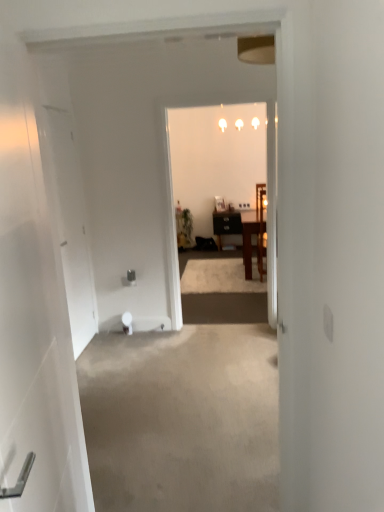
Question: Does wooden chair at center, the 2th chair viewed from the front, have a greater height compared to white glossy light fixture at upper center?

Choices:
 (A) yes
 (B) no

Answer: (A)

Question: Can you confirm if wooden chair at center, the 2th chair viewed from the front, is thinner than white glossy light fixture at upper center?

Choices:
 (A) no
 (B) yes

Answer: (A)

Question: Can you confirm if wooden chair at center, the 2th chair viewed from the front, is shorter than white glossy light fixture at upper center?

Choices:
 (A) no
 (B) yes

Answer: (A)

Question: Is white glossy light fixture at upper center at the back of wooden chair at center, which is the first chair in back-to-front order?

Choices:
 (A) no
 (B) yes

Answer: (A)

Question: Is wooden chair at center, which is the first chair in back-to-front order, positioned in front of white glossy light fixture at upper center?

Choices:
 (A) no
 (B) yes

Answer: (B)

Question: Is white glossy door at left, positioned as the second door in back-to-front order, spatially inside white matte door at left, placed as the first door when sorted from back to front, or outside of it?

Choices:
 (A) inside
 (B) outside

Answer: (B)

Question: From the image's perspective, is white glossy door at left, positioned as the second door in back-to-front order, above or below white matte door at left, the second door in the right-to-left sequence?

Choices:
 (A) above
 (B) below

Answer: (B)

Question: Does point (38, 446) appear closer or farther from the camera than point (72, 321)?

Choices:
 (A) closer
 (B) farther

Answer: (A)

Question: Based on their positions, is white glossy door at left, the 2th door in the left-to-right sequence, located to the left or right of white matte door at left, placed as the first door when sorted from back to front?

Choices:
 (A) left
 (B) right

Answer: (B)

Question: Does point (261, 279) appear closer or farther from the camera than point (61, 114)?

Choices:
 (A) closer
 (B) farther

Answer: (B)

Question: From a real-world perspective, relative to white matte door at left, marked as the 1th door in a left-to-right arrangement, is wooden chair at center, the 2th chair positioned from the back, vertically above or below?

Choices:
 (A) below
 (B) above

Answer: (A)

Question: Is wooden chair at center, the 2th chair positioned from the back, taller or shorter than white matte door at left, placed as the first door when sorted from back to front?

Choices:
 (A) tall
 (B) short

Answer: (B)

Question: Considering the relative positions of wooden chair at center, the 2th chair positioned from the back, and white matte door at left, placed as the first door when sorted from back to front, in the image provided, is wooden chair at center, the 2th chair positioned from the back, to the left or to the right of white matte door at left, placed as the first door when sorted from back to front,?

Choices:
 (A) right
 (B) left

Answer: (A)

Question: From the image's perspective, is wooden chair at center, the 2th chair viewed from the front, located above or below green matte houseplant at center?

Choices:
 (A) below
 (B) above

Answer: (A)

Question: Considering their positions, is wooden chair at center, which is the first chair in back-to-front order, located in front of or behind green matte houseplant at center?

Choices:
 (A) behind
 (B) front

Answer: (B)